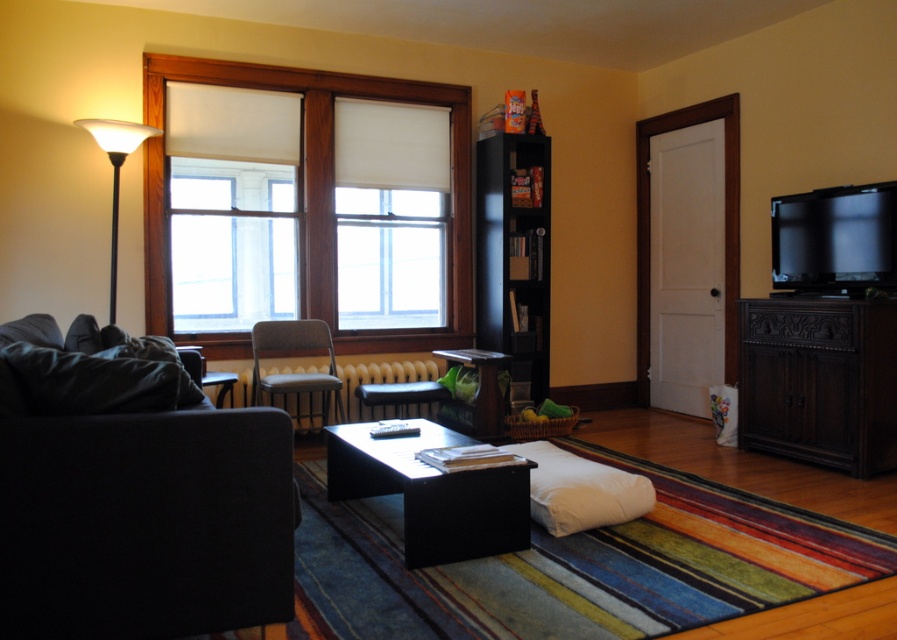
Is dark gray fabric couch at left behind white frosted glass floor lamp at left?

That is False.

Is dark gray fabric couch at left shorter than white frosted glass floor lamp at left?

Correct, dark gray fabric couch at left is not as tall as white frosted glass floor lamp at left.

Between point (239, 611) and point (106, 152), which one is positioned behind?

Point (106, 152)

Find the location of a particular element. The image size is (897, 640). dark gray fabric couch at left is located at coordinates (144, 525).

Does black matte coffee table at center appear on the right side of black wood bookshelf at center?

Incorrect, black matte coffee table at center is not on the right side of black wood bookshelf at center.

Based on the photo, can you confirm if black matte coffee table at center is positioned to the left of black wood bookshelf at center?

Correct, you'll find black matte coffee table at center to the left of black wood bookshelf at center.

Is point (472, 497) positioned after point (543, 260)?

No.

This screenshot has width=897, height=640. In order to click on black matte coffee table at center in this screenshot , I will do `click(432, 492)`.

Can you confirm if dark green fabric pillow at lower left is positioned above beige fabric chair at center?

Indeed, dark green fabric pillow at lower left is positioned over beige fabric chair at center.

From the picture: Who is taller, dark green fabric pillow at lower left or beige fabric chair at center?

With more height is beige fabric chair at center.

You are a GUI agent. You are given a task and a screenshot of the screen. Output one action in this format:
    pyautogui.click(x=<x>, y=<y>)
    Task: Click on the dark green fabric pillow at lower left
    
    Given the screenshot: What is the action you would take?
    pyautogui.click(x=88, y=384)